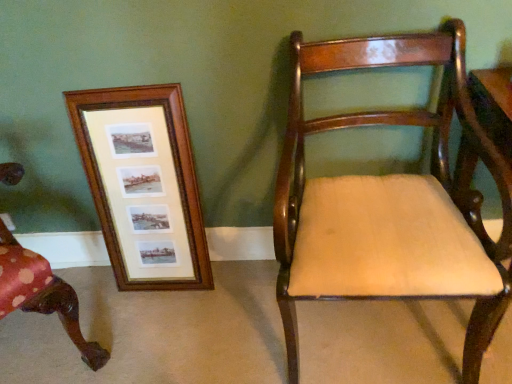
Find the location of a particular element. Image resolution: width=512 pixels, height=384 pixels. free region under wooden chair at left, which is counted as the second chair, starting from the right (from a real-world perspective) is located at coordinates (36, 349).